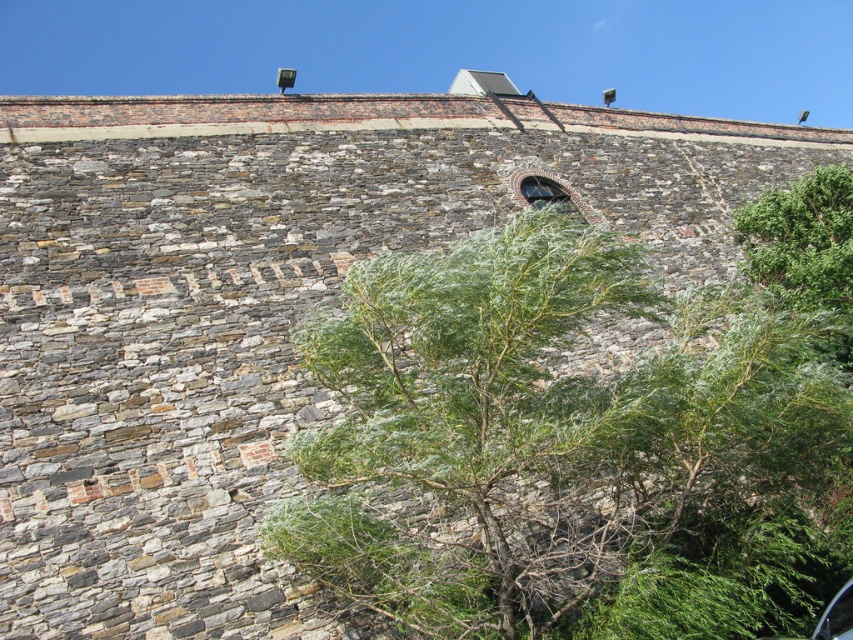
You are standing in front of the stone wall and want to know which plant is taller between the green leafy tree at center and the green leafy bush at upper right. Can you determine this based on the scene?

The green leafy tree at center is taller than the green leafy bush at upper right according to the description.

You are standing 20 meters away from a large stone wall. You want to reach a specific point marked at coordinates point (540, 429) on the wall. Can you safely step forward to reach it without overextending?

The distance of point (540, 429) from viewer is 21.50 meters, so stepping forward from 20 meters away would require moving 1.5 meters closer to reach the point. This should be safe as long as there is clear space to move forward.

You are standing in front of the stone wall and want to touch both the green leafy tree at center and the green leafy bush at upper right. Which one can you reach first without moving your position?

The green leafy tree at center is closer to the viewer than the green leafy bush at upper right, so you can reach it first without moving.